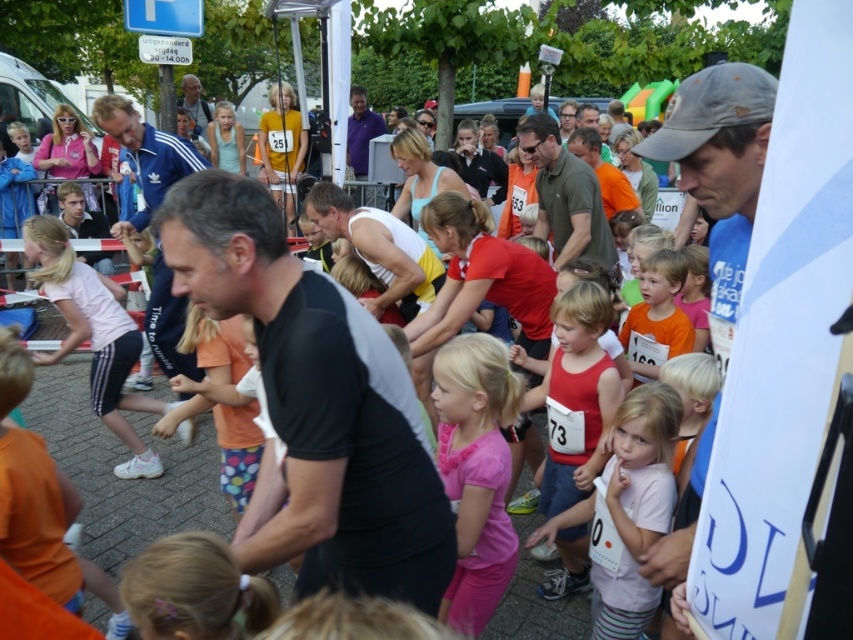
Does point (630, 204) come behind point (202, 113)?

That is False.

Is orange t-shirt at center above matte black tank top at center?

Incorrect, orange t-shirt at center is not positioned above matte black tank top at center.

Is point (578, 154) behind point (190, 109)?

That is False.

Locate an element on the screen. This screenshot has width=853, height=640. orange t-shirt at center is located at coordinates (604, 173).

Does pink matte shirt at center lie behind orange cotton shirt at center?

No, it is not.

This screenshot has height=640, width=853. What do you see at coordinates (474, 472) in the screenshot?
I see `pink matte shirt at center` at bounding box center [474, 472].

Identify the location of pink matte shirt at center. The image size is (853, 640). (474, 472).

Between black matte shirt at center and pale pink fabric shirt at center, which one has more height?

black matte shirt at center

Measure the distance between black matte shirt at center and camera.

black matte shirt at center is 1.67 meters away from camera.

Which is in front, point (308, 504) or point (637, 401)?

Point (308, 504) is in front.

Locate an element on the screen. black matte shirt at center is located at coordinates (317, 403).